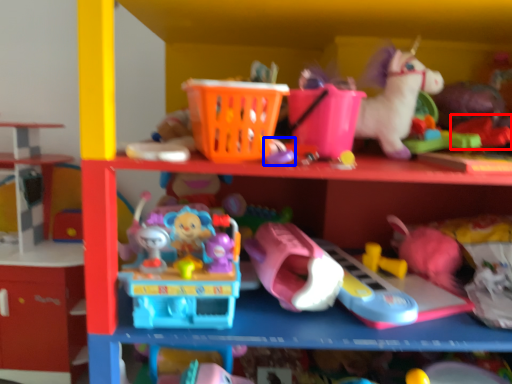
Question: Which object is closer to the camera taking this photo, toy (highlighted by a red box) or toy (highlighted by a blue box)?

Choices:
 (A) toy
 (B) toy

Answer: (B)